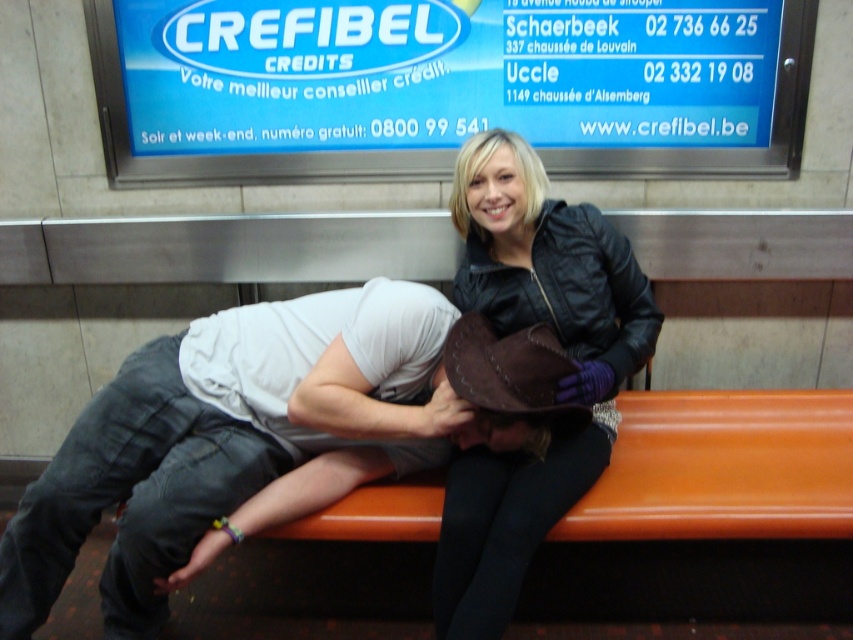
Who is taller, gray cotton pants at left or leather jacket at center?

leather jacket at center

From the picture: Who is positioned more to the right, gray cotton pants at left or leather jacket at center?

From the viewer's perspective, leather jacket at center appears more on the right side.

Between point (115, 636) and point (608, 262), which one is positioned behind?

Point (608, 262)

Where is `gray cotton pants at left`? gray cotton pants at left is located at coordinates (224, 436).